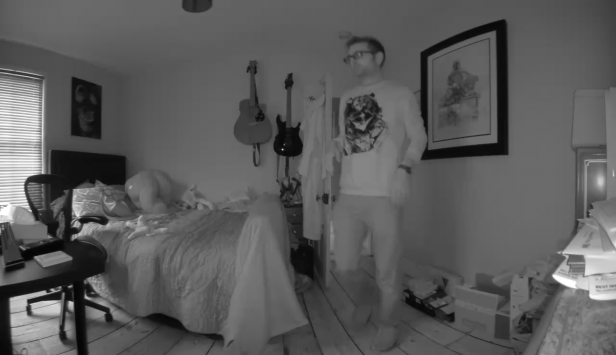
The image size is (616, 355). Identify the location of wall. (546, 100).